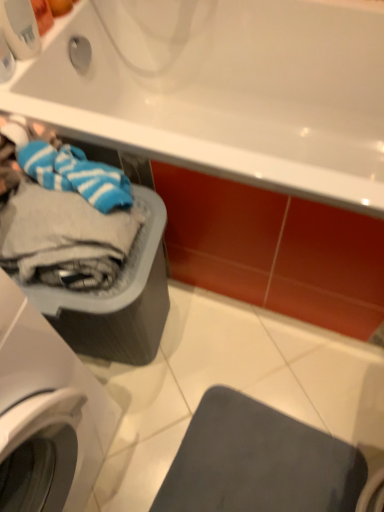
Question: Should I look upward or downward to see matte gray mat at lower right?

Choices:
 (A) up
 (B) down

Answer: (B)

Question: Is white glossy bathtub at upper center positioned behind matte gray mat at lower right?

Choices:
 (A) no
 (B) yes

Answer: (A)

Question: From the image's perspective, is white glossy bathtub at upper center on matte gray mat at lower right?

Choices:
 (A) no
 (B) yes

Answer: (B)

Question: Does white glossy bathtub at upper center have a larger size compared to matte gray mat at lower right?

Choices:
 (A) no
 (B) yes

Answer: (B)

Question: From a real-world perspective, is white glossy bathtub at upper center on top of matte gray mat at lower right?

Choices:
 (A) no
 (B) yes

Answer: (B)

Question: Is white glossy bathtub at upper center positioned with its back to matte gray mat at lower right?

Choices:
 (A) no
 (B) yes

Answer: (A)

Question: Does white glossy bathtub at upper center appear on the left side of matte gray mat at lower right?

Choices:
 (A) yes
 (B) no

Answer: (A)

Question: Is matte gray mat at lower right at the back of white plastic washing machine at left?

Choices:
 (A) no
 (B) yes

Answer: (A)

Question: Does white plastic washing machine at left have a smaller size compared to matte gray mat at lower right?

Choices:
 (A) yes
 (B) no

Answer: (B)

Question: Can you confirm if white plastic washing machine at left is thinner than matte gray mat at lower right?

Choices:
 (A) yes
 (B) no

Answer: (B)

Question: Does white plastic washing machine at left turn towards matte gray mat at lower right?

Choices:
 (A) no
 (B) yes

Answer: (B)

Question: From the image's perspective, is white plastic washing machine at left over matte gray mat at lower right?

Choices:
 (A) no
 (B) yes

Answer: (B)

Question: Does white plastic washing machine at left lie behind matte gray mat at lower right?

Choices:
 (A) no
 (B) yes

Answer: (A)

Question: Does white plastic washing machine at left contain white glossy bathtub at upper center?

Choices:
 (A) no
 (B) yes

Answer: (A)